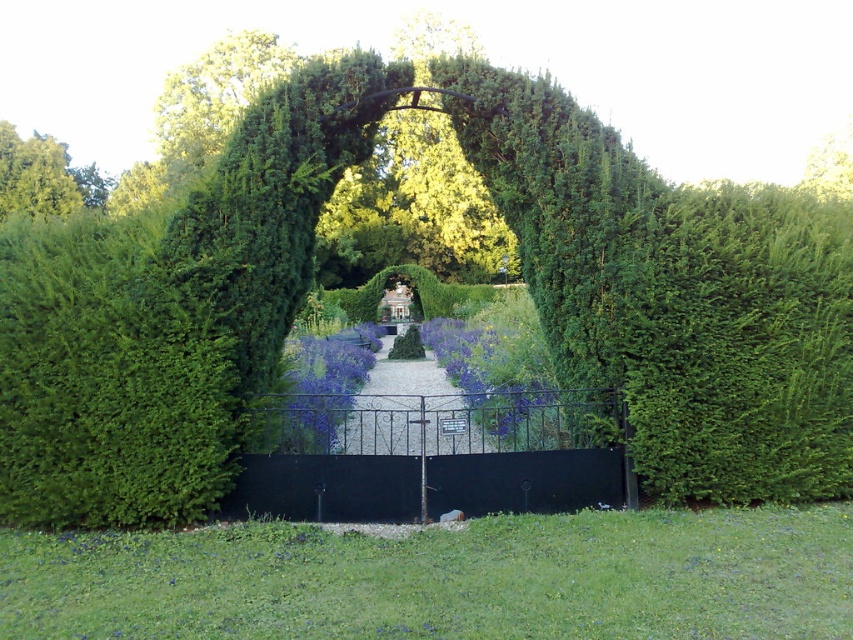
You are standing at the entrance of the garden and want to locate two specific points marked in the image. Which of the two points, point (27, 356) or point (335, 408), is closer to you?

Point (27, 356) is closer to the viewer than point (335, 408).

You are a gardener who wants to mow the green grass at lower center. You notice the black wrought iron gate at center nearby. Which object is shorter in height?

The green grass at lower center is not as tall as the black wrought iron gate at center, so the green grass at lower center is shorter in height.

You are standing at the entrance of the garden and see the black metal gate with ornate detailing. There is a point marked at coordinates point (x=109, y=380). Based on the garden layout, what does this point most likely represent?

The point (x=109, y=380) most likely represents the green leafy bush at center.